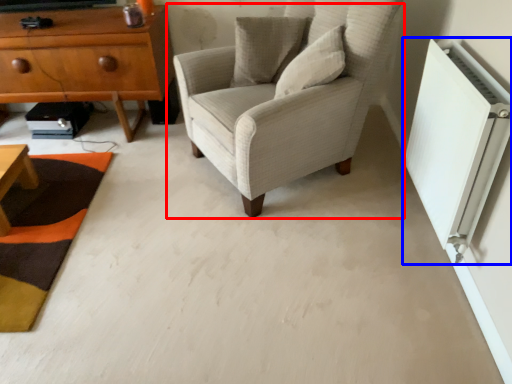
Question: Which object is closer to the camera taking this photo, chair (highlighted by a red box) or air conditioning (highlighted by a blue box)?

Choices:
 (A) chair
 (B) air conditioning

Answer: (B)